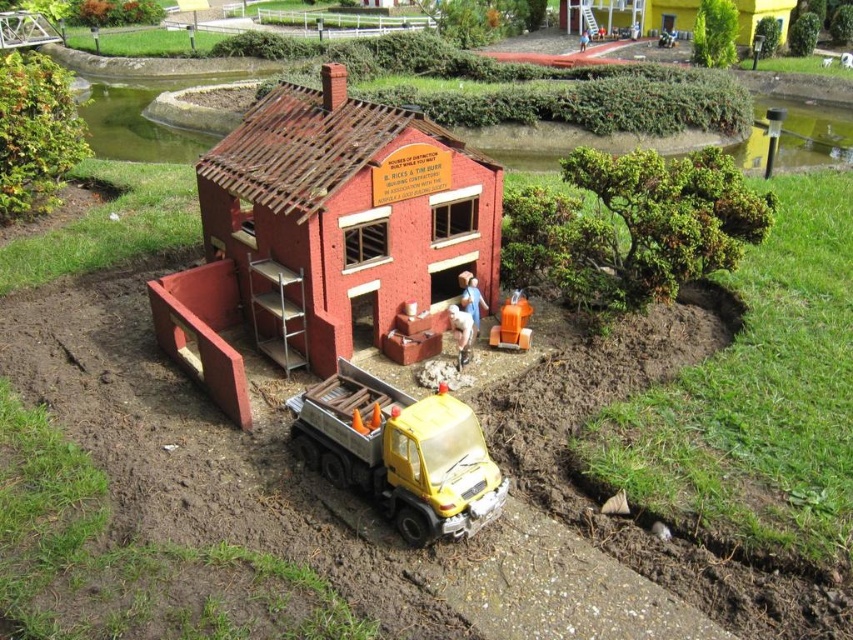
You are looking at a model village scene. There are two points marked in the image. The first point is at coordinate (445, 228) and the second is at (492, 328). Based on the scene, which point is closer to you?

Point (445, 228) is closer to the camera than point (492, 328).

Where is the brick textured house at center located in the image?

The brick textured house at center is located at point [323,232].